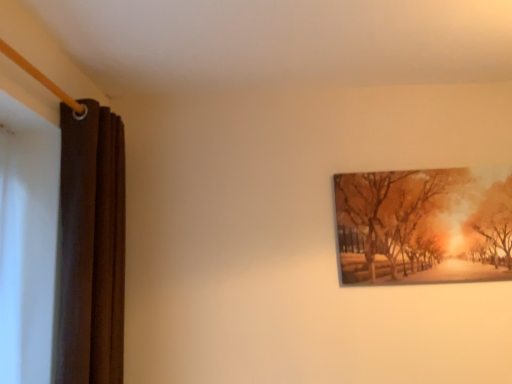
Identify the location of brown velvet curtain at left. The height and width of the screenshot is (384, 512). (90, 248).

The height and width of the screenshot is (384, 512). Describe the element at coordinates (90, 248) in the screenshot. I see `brown velvet curtain at left` at that location.

Measure the distance between point (113, 177) and camera.

Point (113, 177) and camera are 1.76 meters apart from each other.

The width and height of the screenshot is (512, 384). In order to click on matte wooden picture frame at upper right in this screenshot , I will do `click(424, 225)`.

This screenshot has height=384, width=512. What do you see at coordinates (424, 225) in the screenshot?
I see `matte wooden picture frame at upper right` at bounding box center [424, 225].

The height and width of the screenshot is (384, 512). In order to click on brown velvet curtain at left in this screenshot , I will do `click(90, 248)`.

Considering the positions of objects brown velvet curtain at left and matte wooden picture frame at upper right in the image provided, who is more to the right, brown velvet curtain at left or matte wooden picture frame at upper right?

From the viewer's perspective, matte wooden picture frame at upper right appears more on the right side.

Considering their positions, is brown velvet curtain at left located in front of or behind matte wooden picture frame at upper right?

brown velvet curtain at left is positioned closer to the viewer than matte wooden picture frame at upper right.

Considering the positions of points (90, 155) and (390, 262), is point (90, 155) farther from camera compared to point (390, 262)?

No, (90, 155) is in front of (390, 262).

From the image's perspective, is brown velvet curtain at left under matte wooden picture frame at upper right?

Correct, brown velvet curtain at left appears lower than matte wooden picture frame at upper right in the image.

From a real-world perspective, which is physically below, brown velvet curtain at left or matte wooden picture frame at upper right?

brown velvet curtain at left, from a real-world perspective.

Based on the photo, in terms of width, does brown velvet curtain at left look wider or thinner when compared to matte wooden picture frame at upper right?

Clearly, brown velvet curtain at left has more width compared to matte wooden picture frame at upper right.

From the picture: Is brown velvet curtain at left taller than matte wooden picture frame at upper right?

Yes.

Who is smaller, brown velvet curtain at left or matte wooden picture frame at upper right?

With smaller size is matte wooden picture frame at upper right.

Is brown velvet curtain at left completely or partially outside of matte wooden picture frame at upper right?

brown velvet curtain at left is positioned outside matte wooden picture frame at upper right.

Does brown velvet curtain at left touch matte wooden picture frame at upper right?

They are not placed beside each other.

Could you tell me if brown velvet curtain at left is facing matte wooden picture frame at upper right?

Yes, brown velvet curtain at left is turned towards matte wooden picture frame at upper right.

What's the angular difference between brown velvet curtain at left and matte wooden picture frame at upper right's facing directions?

89.8 degrees separate the facing orientations of brown velvet curtain at left and matte wooden picture frame at upper right.

Find the location of `picture frame positioned vertically above the brown velvet curtain at left (from a real-world perspective)`. picture frame positioned vertically above the brown velvet curtain at left (from a real-world perspective) is located at coordinates (424, 225).

Can you confirm if matte wooden picture frame at upper right is positioned to the left of brown velvet curtain at left?

Incorrect, matte wooden picture frame at upper right is not on the left side of brown velvet curtain at left.

Does matte wooden picture frame at upper right lie in front of brown velvet curtain at left?

No.

Does point (361, 179) come closer to viewer compared to point (106, 370)?

No.

From the image's perspective, which one is positioned higher, matte wooden picture frame at upper right or brown velvet curtain at left?

matte wooden picture frame at upper right.

From a real-world perspective, between matte wooden picture frame at upper right and brown velvet curtain at left, who is vertically lower?

From a 3D spatial view, brown velvet curtain at left is below.

Considering the sizes of objects matte wooden picture frame at upper right and brown velvet curtain at left in the image provided, who is wider, matte wooden picture frame at upper right or brown velvet curtain at left?

brown velvet curtain at left is wider.

Can you confirm if matte wooden picture frame at upper right is taller than brown velvet curtain at left?

Incorrect, the height of matte wooden picture frame at upper right is not larger of that of brown velvet curtain at left.

Looking at the image, does matte wooden picture frame at upper right seem bigger or smaller compared to brown velvet curtain at left?

In the image, matte wooden picture frame at upper right appears to be smaller than brown velvet curtain at left.

Can we say matte wooden picture frame at upper right lies outside brown velvet curtain at left?

Yes, matte wooden picture frame at upper right is located beyond the bounds of brown velvet curtain at left.

Is matte wooden picture frame at upper right next to brown velvet curtain at left?

No.

Could you tell me if matte wooden picture frame at upper right is facing brown velvet curtain at left?

No, matte wooden picture frame at upper right does not turn towards brown velvet curtain at left.

Measure the distance from matte wooden picture frame at upper right to brown velvet curtain at left.

matte wooden picture frame at upper right and brown velvet curtain at left are 1.21 meters apart from each other.

The image size is (512, 384). I want to click on picture frame behind the brown velvet curtain at left, so click(424, 225).

The image size is (512, 384). Find the location of `curtain below the matte wooden picture frame at upper right (from a real-world perspective)`. curtain below the matte wooden picture frame at upper right (from a real-world perspective) is located at coordinates (90, 248).

Find the location of a particular element. picture frame behind the brown velvet curtain at left is located at coordinates (424, 225).